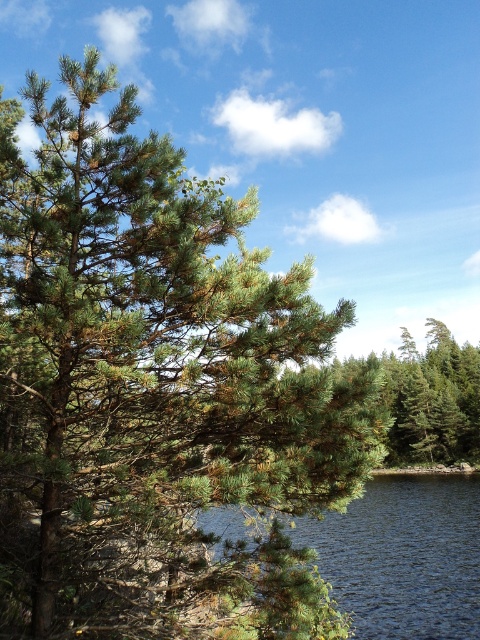
Question: In this image, where is transparent blue water at lower center located relative to green matte tree at center?

Choices:
 (A) above
 (B) below

Answer: (B)

Question: Which point is closer to the camera?

Choices:
 (A) green matte tree at center
 (B) transparent blue water at lower center

Answer: (A)

Question: Can you confirm if transparent blue water at lower center is positioned above green matte tree at center?

Choices:
 (A) yes
 (B) no

Answer: (B)

Question: Does transparent blue water at lower center appear over green matte tree at center?

Choices:
 (A) no
 (B) yes

Answer: (A)

Question: Which point is closer to the camera?

Choices:
 (A) transparent blue water at lower center
 (B) green matte tree at center

Answer: (B)